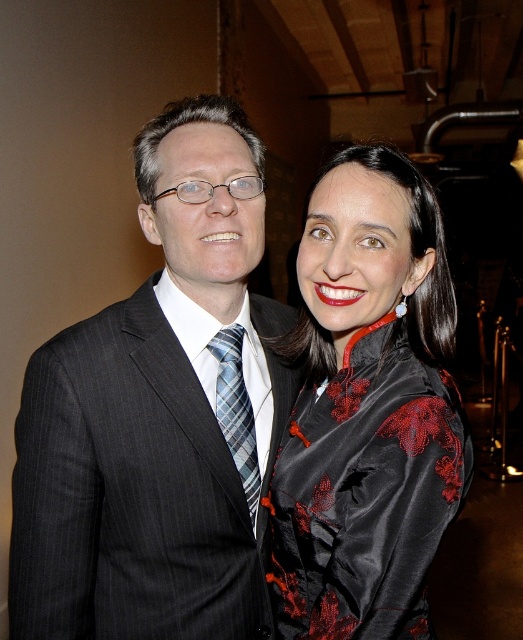
Question: Which of the following is the farthest from the observer?

Choices:
 (A) matte black suit at left
 (B) satin black dress at center
 (C) plaid silk tie at center

Answer: (C)

Question: Does satin black dress at center appear on the left side of plaid silk tie at center?

Choices:
 (A) no
 (B) yes

Answer: (A)

Question: Is matte black suit at left above plaid silk tie at center?

Choices:
 (A) no
 (B) yes

Answer: (B)

Question: Considering the real-world distances, which object is closest to the matte black suit at left?

Choices:
 (A) satin black dress at center
 (B) plaid silk tie at center

Answer: (B)

Question: Considering the real-world distances, which object is farthest from the matte black suit at left?

Choices:
 (A) satin black dress at center
 (B) plaid silk tie at center

Answer: (A)

Question: Is matte black suit at left thinner than satin black dress at center?

Choices:
 (A) no
 (B) yes

Answer: (A)